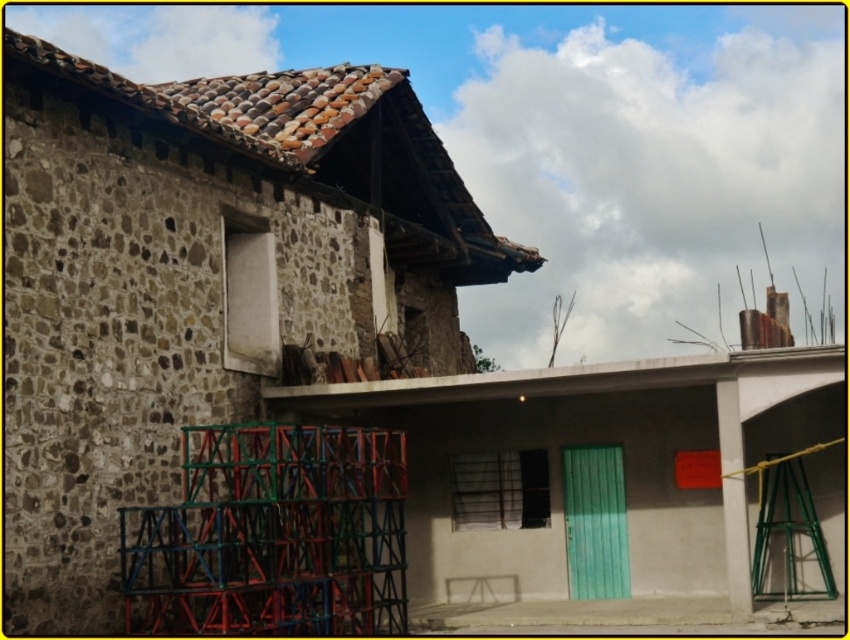
Does brown stone wall at left have a greater height compared to metallic scaffolding at left?

Correct, brown stone wall at left is much taller as metallic scaffolding at left.

Is point (315, 244) positioned before point (290, 634)?

No.

Find the location of `brown stone wall at left`. brown stone wall at left is located at coordinates (197, 280).

Who is higher up, smooth concrete hut at center or metallic scaffolding at left?

smooth concrete hut at center is higher up.

Can you confirm if smooth concrete hut at center is positioned to the right of metallic scaffolding at left?

Indeed, smooth concrete hut at center is positioned on the right side of metallic scaffolding at left.

Where is `smooth concrete hut at center`? Image resolution: width=850 pixels, height=640 pixels. smooth concrete hut at center is located at coordinates (605, 483).

Where is `smooth concrete hut at center`? smooth concrete hut at center is located at coordinates (605, 483).

Can you confirm if brown stone wall at left is positioned to the right of smooth concrete hut at center?

In fact, brown stone wall at left is to the left of smooth concrete hut at center.

Between point (412, 147) and point (452, 580), which one is positioned in front?

Point (452, 580) is more forward.

Who is more distant from viewer, (296, 176) or (610, 554)?

The point (610, 554) is behind.

Image resolution: width=850 pixels, height=640 pixels. In order to click on brown stone wall at left in this screenshot , I will do `click(197, 280)`.